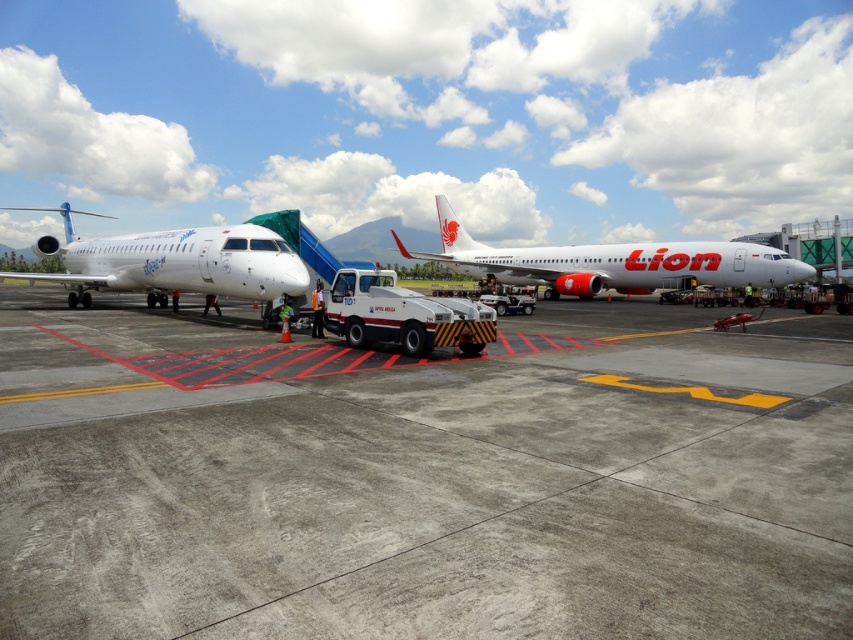
You are a pilot standing at the point marked by coordinates point (422, 477). You need to walk to the airplane on the right. Which direction should you walk to reach the airplane on the right?

The point (422, 477) indicates gray concrete tarmac at center. The airplane on the right is located to the east of the center point, so you should walk east to reach the airplane on the right.

You are a flight attendant assigned to the white glossy airplane at left and the white matte airplane at center. You need to determine which plane requires more cabin crew members based on their sizes. Which one needs more crew?

The white matte airplane at center requires more cabin crew members because it is larger than the white glossy airplane at left.